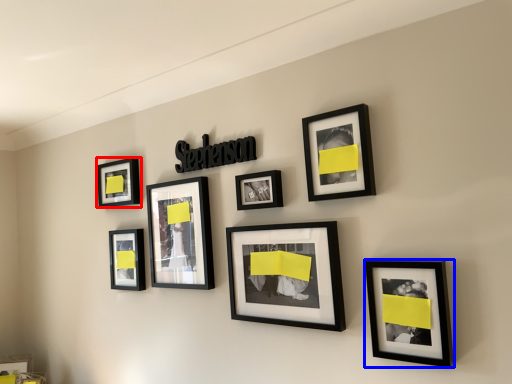
Question: Which object appears farthest to the camera in this image, picture frame (highlighted by a red box) or picture frame (highlighted by a blue box)?

Choices:
 (A) picture frame
 (B) picture frame

Answer: (A)